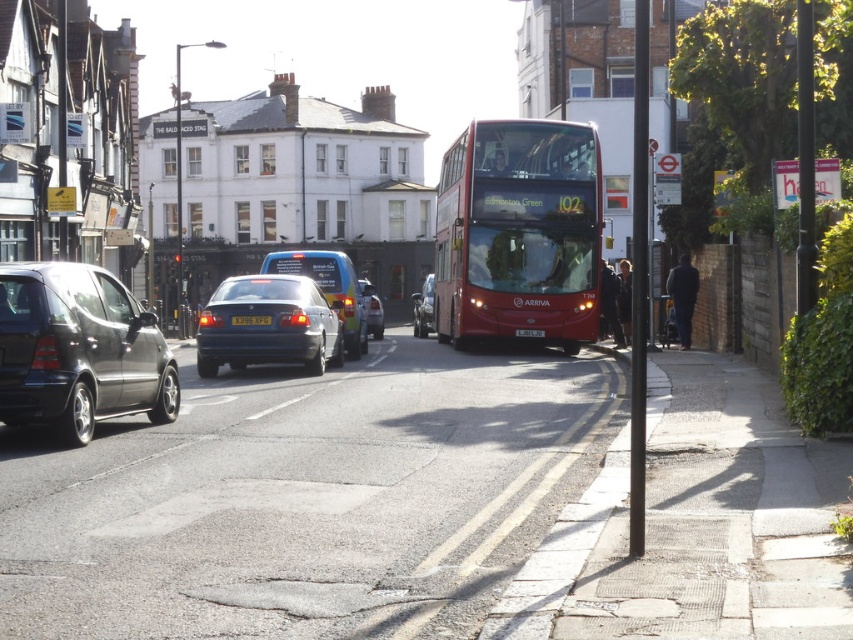
Does shiny red bus at center have a smaller size compared to blue metallic van at center?

Result: Yes.

Does shiny red bus at center appear on the right side of blue metallic van at center?

Yes, shiny red bus at center is to the right of blue metallic van at center.

Who is more forward, (532, 234) or (341, 253)?

Positioned in front is point (532, 234).

Locate an element on the screen. The width and height of the screenshot is (853, 640). shiny red bus at center is located at coordinates (519, 234).

Can you confirm if yellow matte license plate at center is positioned to the right of black plastic license plate at center?

Incorrect, yellow matte license plate at center is not on the right side of black plastic license plate at center.

Can you confirm if yellow matte license plate at center is positioned below black plastic license plate at center?

Incorrect, yellow matte license plate at center is not positioned below black plastic license plate at center.

This screenshot has height=640, width=853. What do you see at coordinates (251, 320) in the screenshot?
I see `yellow matte license plate at center` at bounding box center [251, 320].

Where is `yellow matte license plate at center`? The image size is (853, 640). yellow matte license plate at center is located at coordinates (251, 320).

Is blue metallic van at center shorter than black plastic license plate at center?

No.

Does blue metallic van at center appear on the right side of black plastic license plate at center?

No, blue metallic van at center is not to the right of black plastic license plate at center.

Which is behind, point (350, 339) or point (543, 332)?

Point (543, 332)

You are a GUI agent. You are given a task and a screenshot of the screen. Output one action in this format:
    pyautogui.click(x=<x>, y=<y>)
    Task: Click on the blue metallic van at center
    The width and height of the screenshot is (853, 640).
    Given the screenshot: What is the action you would take?
    pyautogui.click(x=328, y=288)